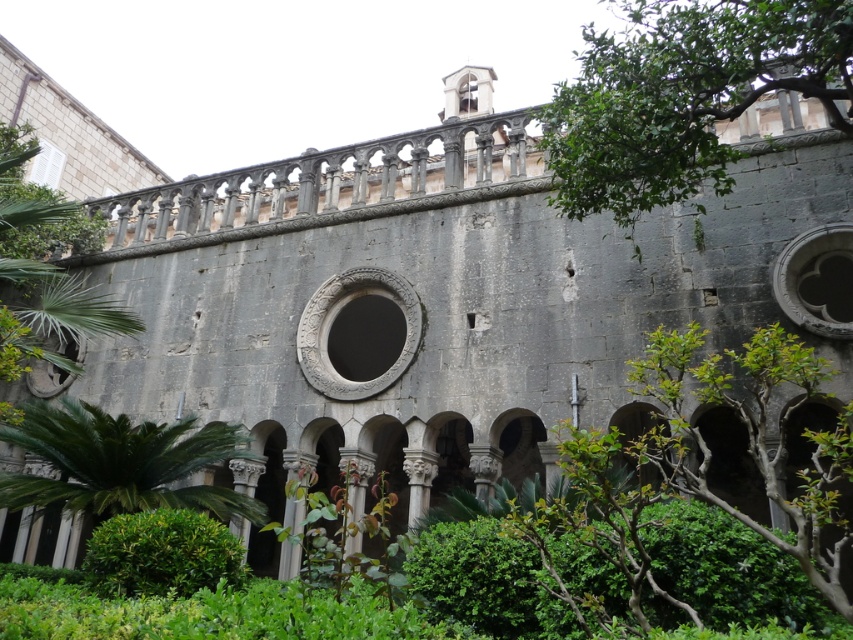
Question: Does green leafy tree at upper left have a lesser width compared to green leafy bush at lower center?

Choices:
 (A) no
 (B) yes

Answer: (A)

Question: Which point is closer to the camera?

Choices:
 (A) green leafy plant at lower left
 (B) green leafy tree at upper right
 (C) green leafy tree at upper left
 (D) green leafy bush at lower center

Answer: (B)

Question: Based on their relative distances, which object is nearer to the green leafy tree at upper left?

Choices:
 (A) green leafy bush at lower center
 (B) green leafy tree at upper right
 (C) green leafy plant at lower left

Answer: (C)

Question: Does green leafy plant at lower left have a smaller size compared to green leafy bush at lower center?

Choices:
 (A) yes
 (B) no

Answer: (B)

Question: Can you confirm if green leafy tree at upper right is positioned to the right of green leafy bush at lower center?

Choices:
 (A) yes
 (B) no

Answer: (A)

Question: Among these objects, which one is farthest from the camera?

Choices:
 (A) green leafy bush at lower center
 (B) green leafy plant at lower left
 (C) green leafy tree at upper left
 (D) green leafy tree at upper right

Answer: (B)